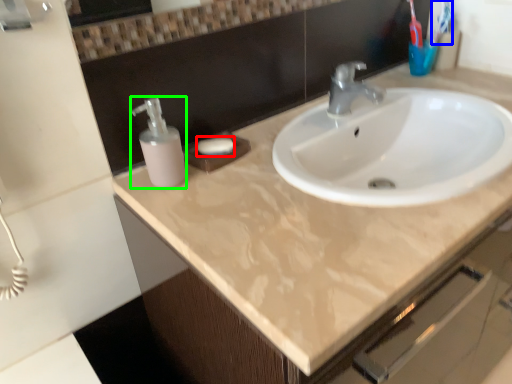
Question: Based on their relative distances, which object is nearer to soap (highlighted by a red box)? Choose from toothbrush (highlighted by a blue box) and soap dispenser (highlighted by a green box).

Choices:
 (A) toothbrush
 (B) soap dispenser

Answer: (B)